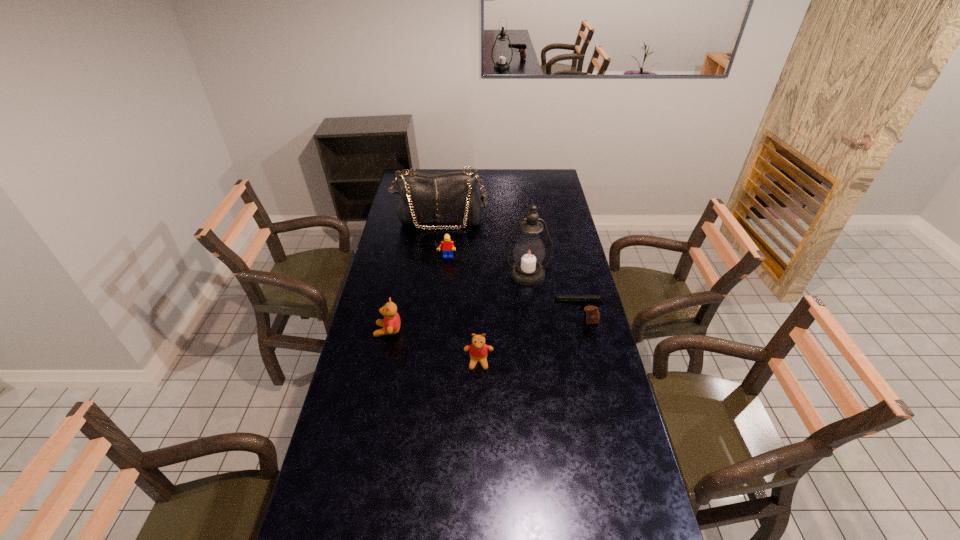
The image size is (960, 540). What are the coordinates of `the farther teddy bear` in the screenshot? It's located at (391, 323).

At what (x,y) coordinates should I click in order to perform the action: click on the left teddy bear. Please return your answer as a coordinate pair (x, y). Looking at the image, I should click on (391, 323).

The height and width of the screenshot is (540, 960). I want to click on the shorter teddy bear, so click(x=478, y=350).

Identify the location of the nearest object. The height and width of the screenshot is (540, 960). (x=478, y=350).

Where is `the second farthest object`? the second farthest object is located at coordinates (448, 246).

Where is `the farthest object`? the farthest object is located at coordinates (450, 197).

Image resolution: width=960 pixels, height=540 pixels. Find the location of `handbag`. handbag is located at coordinates (450, 197).

Locate an element on the screen. the third farthest object is located at coordinates (529, 251).

I want to click on the tallest object, so click(529, 251).

Where is `pistol`? The image size is (960, 540). pistol is located at coordinates (590, 303).